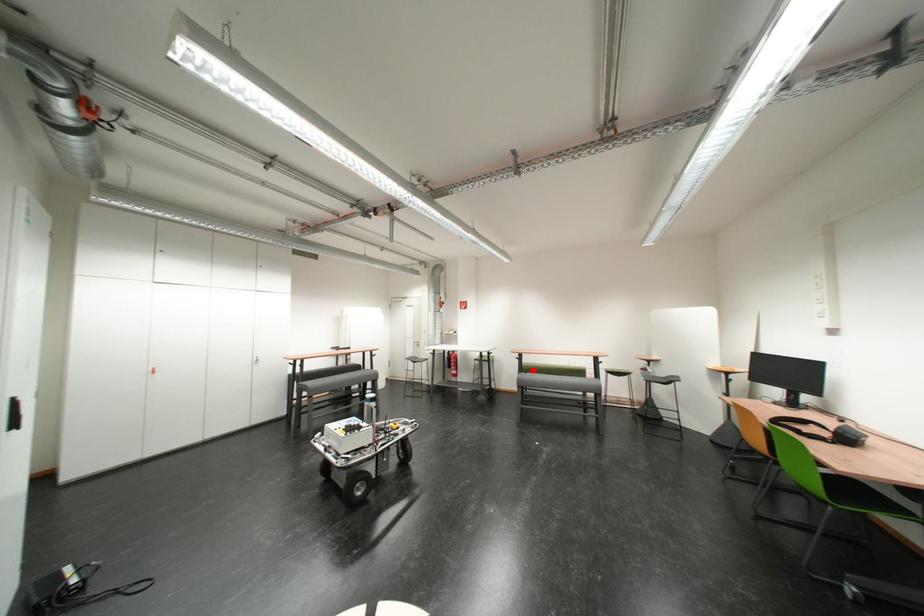
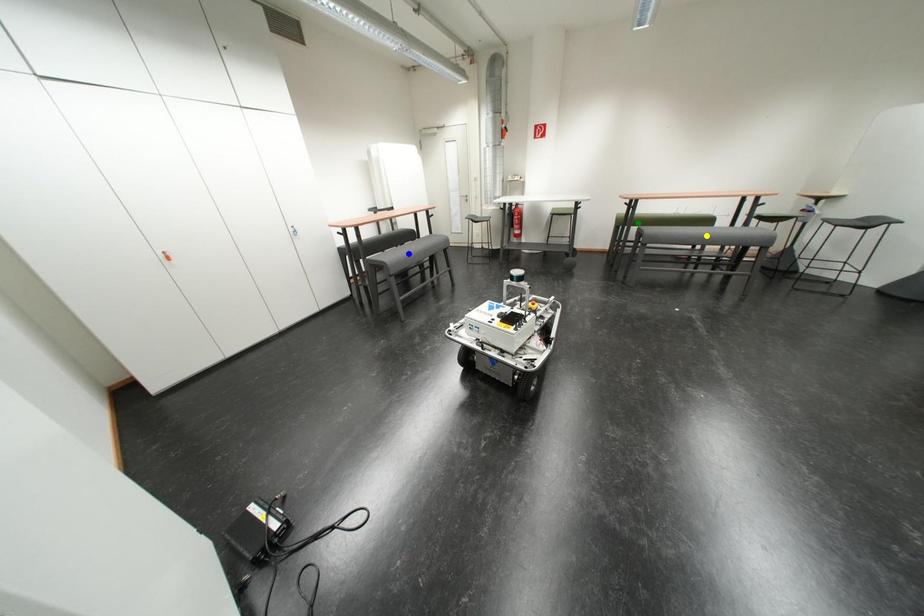
Question: I am providing you with two images of the same scene from different viewpoints. A red point is marked on the first image. You are given multiple points on the second image. Which point in image 2 is actually the same real-world point as the red point in image 1?

Choices:
 (A) blue point
 (B) yellow point
 (C) green point

Answer: (C)